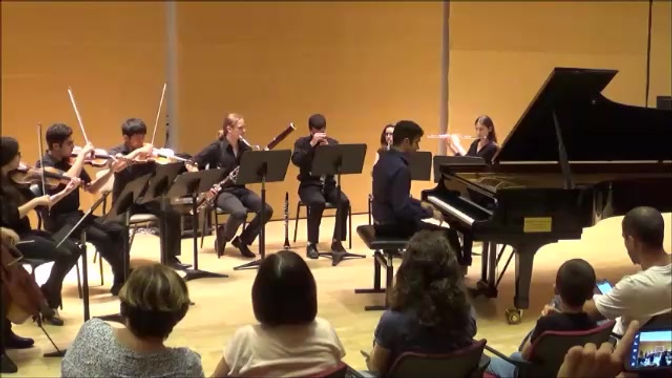
The image size is (672, 378). What are the coordinates of `brown wall` in the screenshot? It's located at (332, 86).